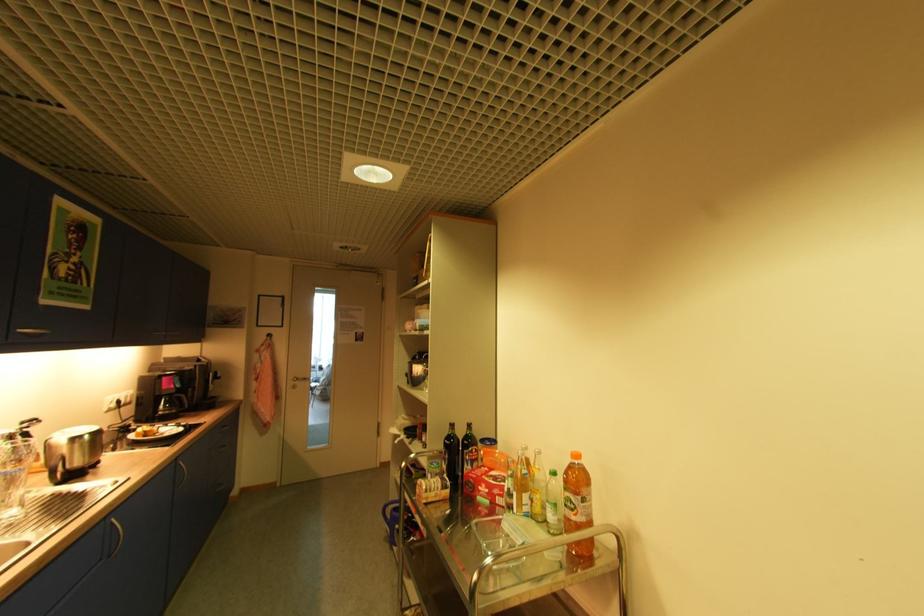
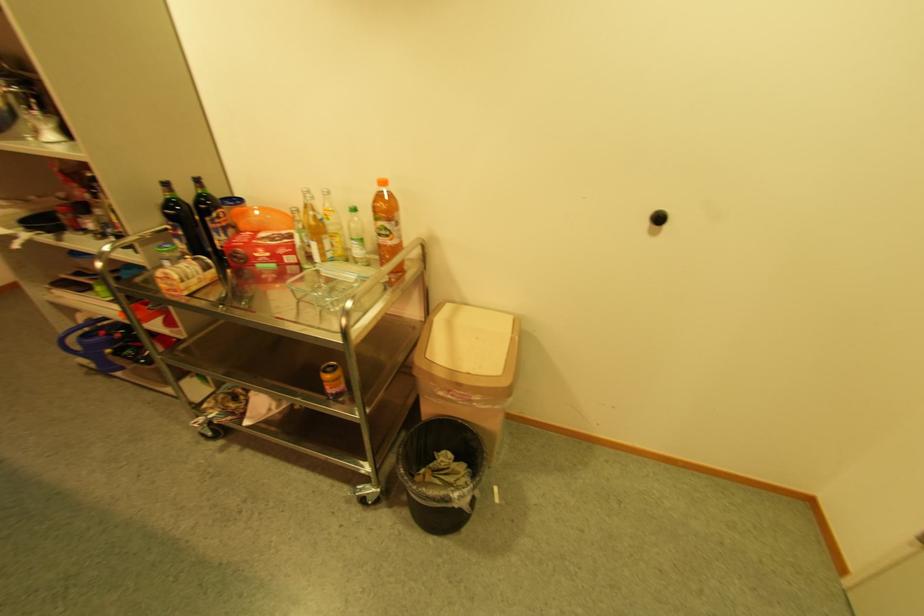
Find the pixel in the second image that matches point (517, 533) in the first image.

(344, 278)